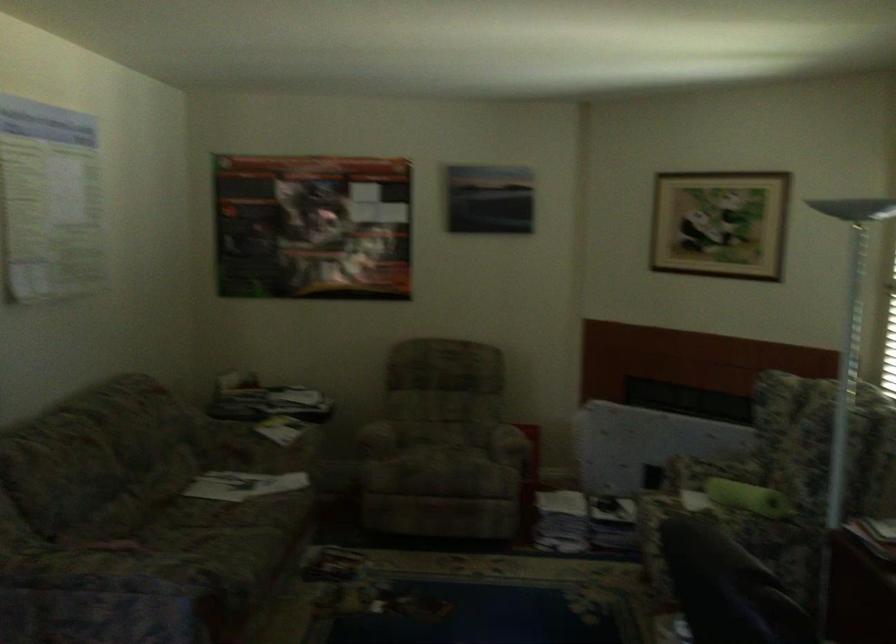
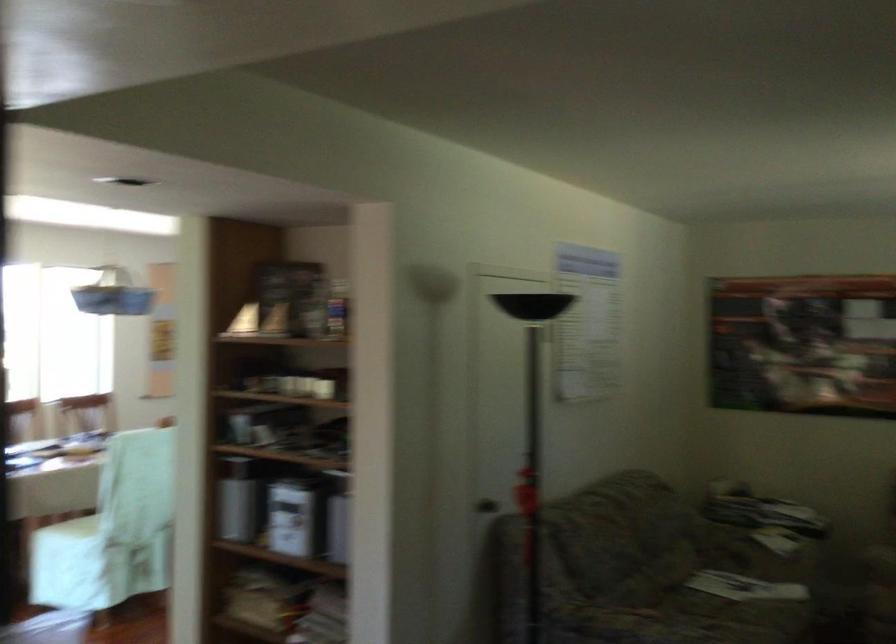
What movement of the cameraman would produce the second image?

The cameraman moved toward left, backward.